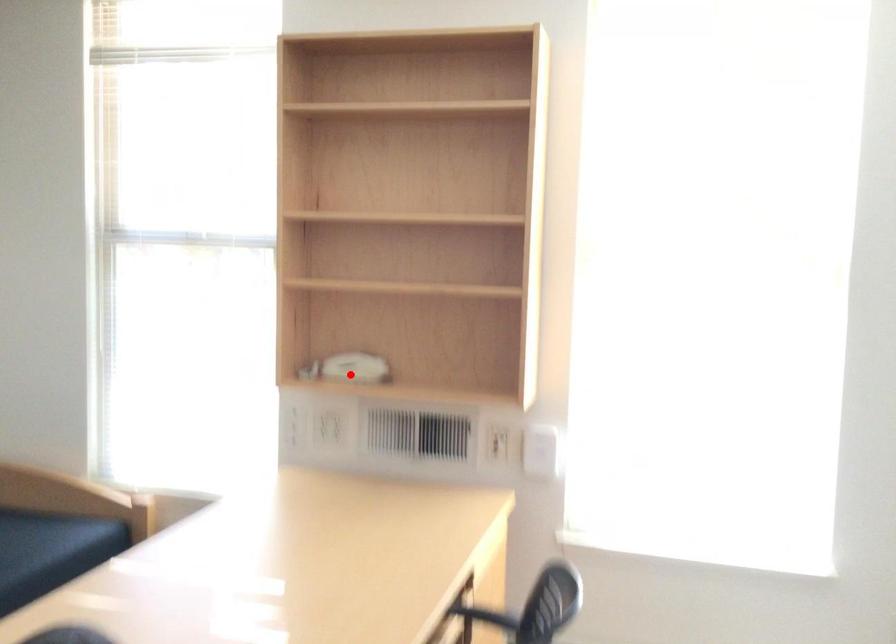
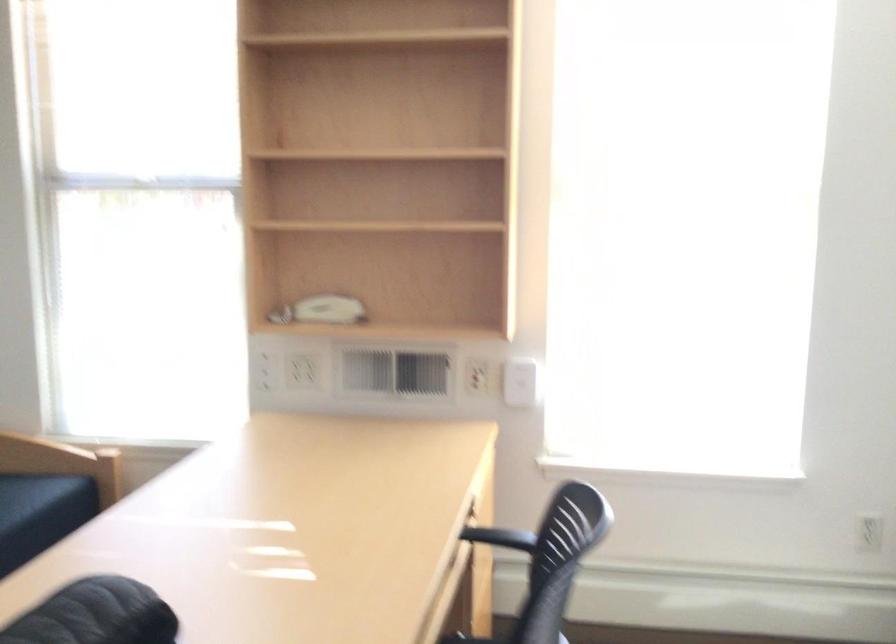
Where in the second image is the point corresponding to the highlighted location from the first image?

(324, 314)